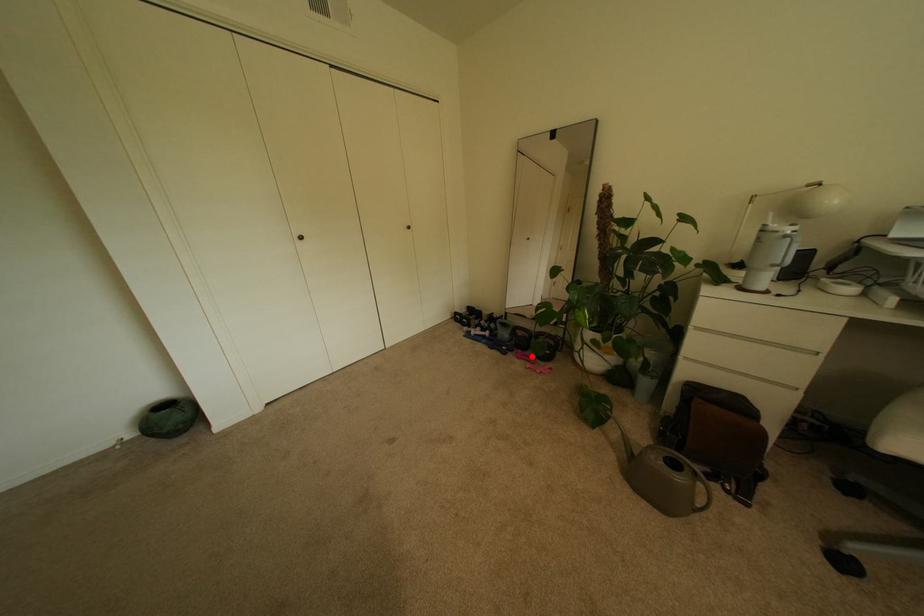
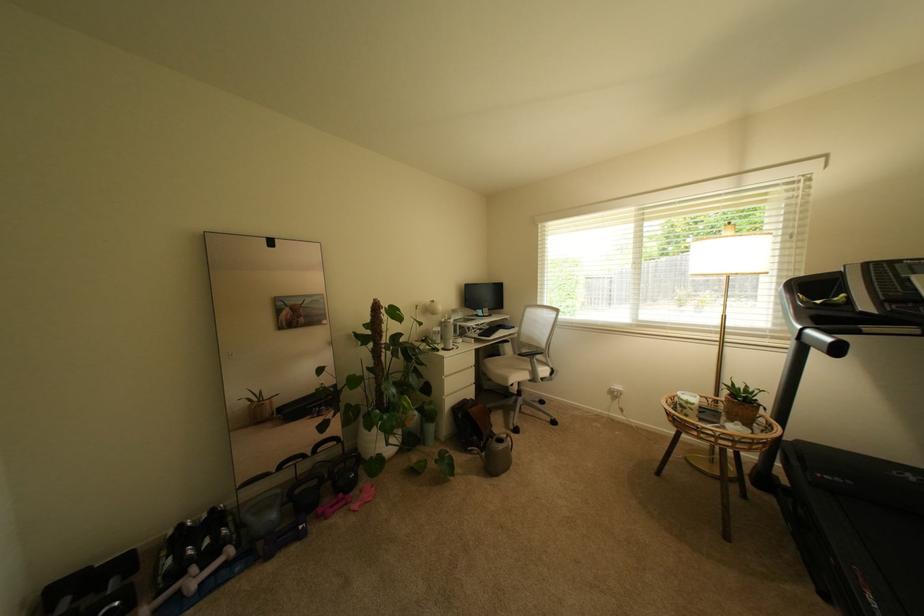
Question: I am providing you with two images of the same scene from different viewpoints. A red point is marked on the first image. Can you still see the location of the red point in image 2?

Choices:
 (A) Yes
 (B) No

Answer: (A)